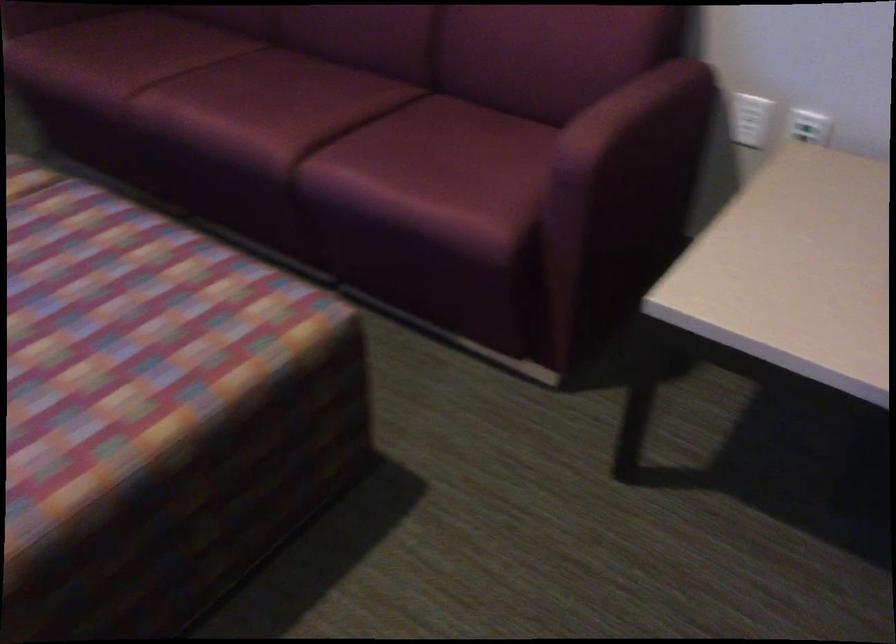
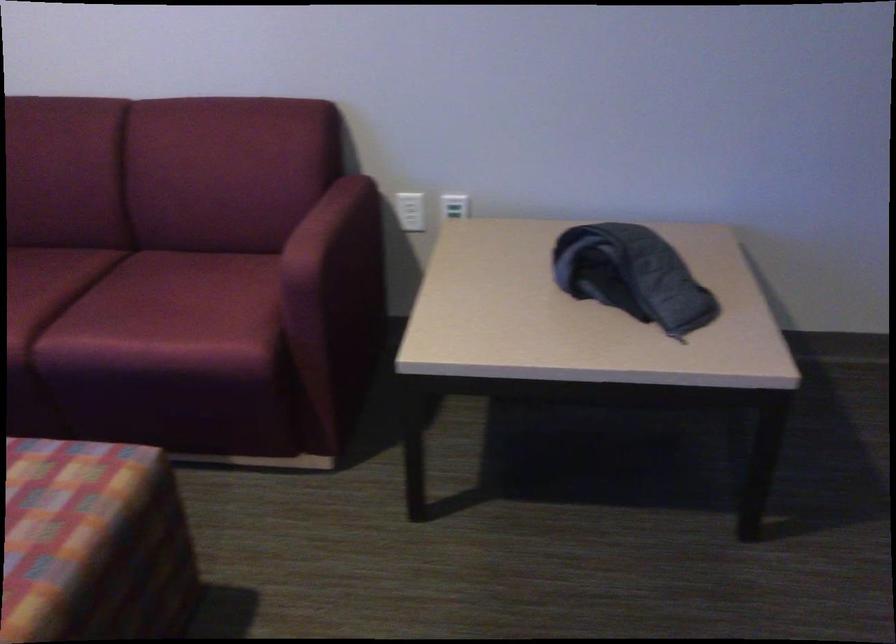
Where in the second image is the point corresponding to pixel 448 147 from the first image?

(175, 290)